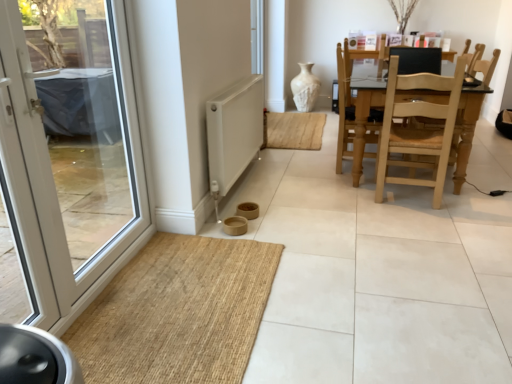
Locate an element on the screen. This screenshot has width=512, height=384. vacant space situated on the left part of light wood/wooden chair at right is located at coordinates (351, 198).